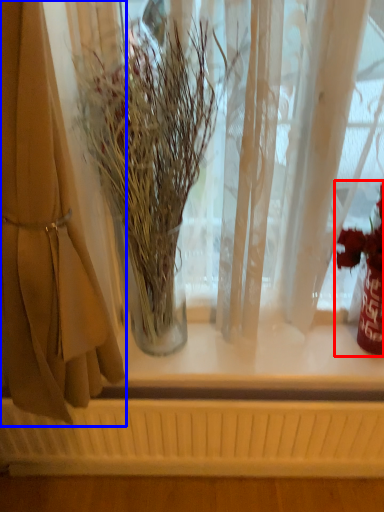
Question: Among these objects, which one is nearest to the camera, floral arrangement (highlighted by a red box) or curtain (highlighted by a blue box)?

Choices:
 (A) floral arrangement
 (B) curtain

Answer: (B)